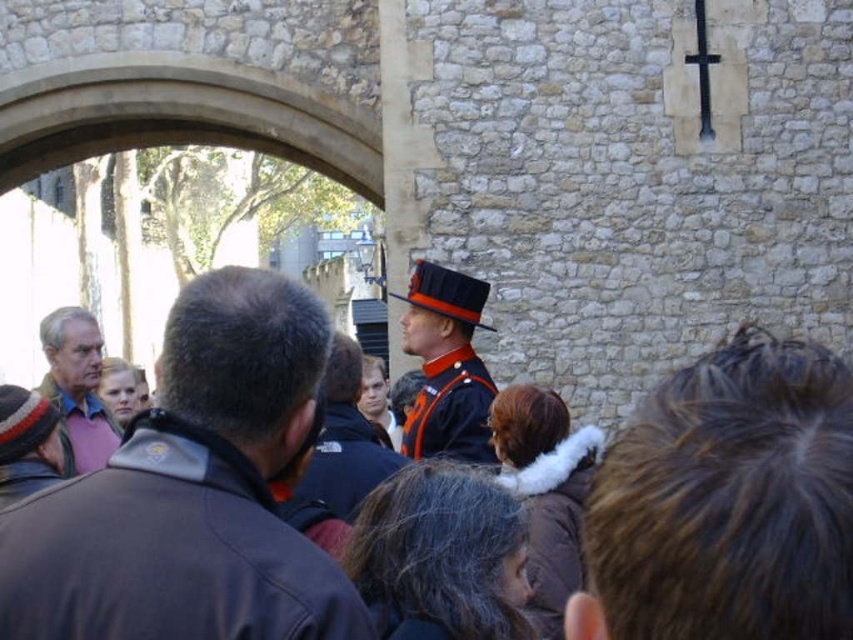
You are a photographer trying to capture a clear photo of the shiny blue uniform at center without the pink fabric shirt at left blocking it. What should you do?

Move to the side so that the shiny blue uniform at center is no longer blocked by the pink fabric shirt at left, since the shiny blue uniform at center is currently behind the pink fabric shirt at left.

You are a tour guide at the historic stone building. You notice two people in orange uniforms near the center of the scene. Which one is closer to you, the orange uniform at center or the orange fabric uniform at center?

The orange uniform at center is closer to you because it is in front of the orange fabric uniform at center.

You are a photographer trying to capture a photo of the historic stone building. You notice the pink fabric shirt at left and the shiny blue uniform at center in your frame. Which of these two objects should you adjust your camera focus on if you want to ensure the larger one is in sharp focus?

The pink fabric shirt at left is larger in size than the shiny blue uniform at center, so you should focus on the pink fabric shirt at left to ensure the larger object is in sharp focus.